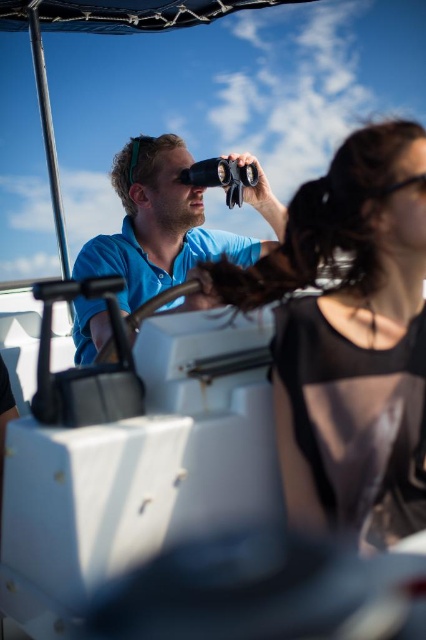
From the picture: You are standing on the boat and want to hand a small item to both the black sheer top at upper right and the matte blue shirt at center. Which person should you give the item to first to ensure it reaches them without needing to move?

You should give the item to the black sheer top at upper right first because they are closer to you than the matte blue shirt at center, so you can hand it directly without needing to move closer.

You are a passenger on the boat and need to hand the matte blue shirt at center an item. The black rubber goggles at upper right are in your line of sight. Which object should you move first to avoid blocking your view?

You should move the black rubber goggles at upper right first because the matte blue shirt at center is located above it, so moving the goggles would clear the lower part of your view, allowing you to see the shirt more clearly.